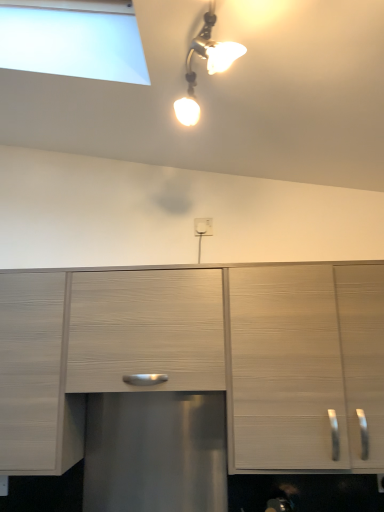
At what (x,y) coordinates should I click in order to perform the action: click on light wood cabinet at right, the second cabinetry when ordered from left to right. Please return your answer as a coordinate pair (x, y). The image size is (384, 512). Looking at the image, I should click on (306, 365).

I want to click on white plastic electric outlet at center, so click(x=203, y=226).

The height and width of the screenshot is (512, 384). Describe the element at coordinates (146, 330) in the screenshot. I see `light wood drawer at center` at that location.

Where is `light wood cabinet at right, the first cabinetry when ordered from right to left`? light wood cabinet at right, the first cabinetry when ordered from right to left is located at coordinates (306, 365).

Between point (243, 456) and point (212, 357), which one is positioned in front?

The point (243, 456) is more forward.

Is light wood cabinet at right, the first cabinetry when ordered from right to left, shorter than light wood drawer at center?

In fact, light wood cabinet at right, the first cabinetry when ordered from right to left, may be taller than light wood drawer at center.

Where is `the 1st cabinetry below the light wood drawer at center (from the image's perspective)`? The width and height of the screenshot is (384, 512). the 1st cabinetry below the light wood drawer at center (from the image's perspective) is located at coordinates (306, 365).

Considering the relative sizes of light wood cabinet at right, the second cabinetry when ordered from left to right, and matte wood cabinet at left, which is counted as the second cabinetry, starting from the right, in the image provided, is light wood cabinet at right, the second cabinetry when ordered from left to right, wider than matte wood cabinet at left, which is counted as the second cabinetry, starting from the right,?

No.

Is matte wood cabinet at left, which is counted as the second cabinetry, starting from the right, surrounded by light wood cabinet at right, the second cabinetry when ordered from left to right?

No, matte wood cabinet at left, which is counted as the second cabinetry, starting from the right, is not surrounded by light wood cabinet at right, the second cabinetry when ordered from left to right.

This screenshot has width=384, height=512. In order to click on cabinetry in front of the matte wood cabinet at left, the first cabinetry when ordered from left to right in this screenshot , I will do click(306, 365).

Consider the image. Is light wood cabinet at right, the first cabinetry when ordered from right to left, taller or shorter than matte wood cabinet at left, the first cabinetry when ordered from left to right?

Considering their sizes, light wood cabinet at right, the first cabinetry when ordered from right to left, has more height than matte wood cabinet at left, the first cabinetry when ordered from left to right.

Is light wood drawer at center facing away from matte wood cabinet at left, the first cabinetry when ordered from left to right?

light wood drawer at center is not turned away from matte wood cabinet at left, the first cabinetry when ordered from left to right.

Between light wood drawer at center and matte wood cabinet at left, the first cabinetry when ordered from left to right, which one has larger width?

With larger width is matte wood cabinet at left, the first cabinetry when ordered from left to right.

Is there a large distance between light wood drawer at center and matte wood cabinet at left, which is counted as the second cabinetry, starting from the right?

No, there isn't a large distance between light wood drawer at center and matte wood cabinet at left, which is counted as the second cabinetry, starting from the right.

Can you confirm if light wood drawer at center is positioned to the left of matte wood cabinet at left, which is counted as the second cabinetry, starting from the right?

No, light wood drawer at center is not to the left of matte wood cabinet at left, which is counted as the second cabinetry, starting from the right.

You are a GUI agent. You are given a task and a screenshot of the screen. Output one action in this format:
    pyautogui.click(x=<x>, y=<y>)
    Task: Click on the cabinetry that is in front of the matte wood cabinet at left, which is counted as the second cabinetry, starting from the right
    The height and width of the screenshot is (512, 384).
    Given the screenshot: What is the action you would take?
    pyautogui.click(x=306, y=365)

From the image's perspective, who appears lower, matte wood cabinet at left, the first cabinetry when ordered from left to right, or light wood cabinet at right, the first cabinetry when ordered from right to left?

matte wood cabinet at left, the first cabinetry when ordered from left to right.

Could you measure the distance between matte wood cabinet at left, the first cabinetry when ordered from left to right, and light wood cabinet at right, the second cabinetry when ordered from left to right?

matte wood cabinet at left, the first cabinetry when ordered from left to right, is 84.53 centimeters away from light wood cabinet at right, the second cabinetry when ordered from left to right.

Considering the points (55, 423) and (207, 230), which point is behind, point (55, 423) or point (207, 230)?

The point (207, 230) is behind.

From the image's perspective, is matte wood cabinet at left, the first cabinetry when ordered from left to right, positioned above or below white plastic electric outlet at center?

Clearly, from the image's perspective, matte wood cabinet at left, the first cabinetry when ordered from left to right, is below white plastic electric outlet at center.

Is matte wood cabinet at left, the first cabinetry when ordered from left to right, facing away from white plastic electric outlet at center?

No, matte wood cabinet at left, the first cabinetry when ordered from left to right,'s orientation is not away from white plastic electric outlet at center.

Consider the image. Who is smaller, matte wood cabinet at left, which is counted as the second cabinetry, starting from the right, or white plastic electric outlet at center?

With smaller size is white plastic electric outlet at center.

Is matte wood cabinet at left, which is counted as the second cabinetry, starting from the right, aimed at light wood drawer at center?

No, matte wood cabinet at left, which is counted as the second cabinetry, starting from the right, is not turned towards light wood drawer at center.

Would you consider matte wood cabinet at left, which is counted as the second cabinetry, starting from the right, to be distant from light wood drawer at center?

They are positioned close to each other.

From the image's perspective, is light wood cabinet at right, the first cabinetry when ordered from right to left, above or below white plastic electric outlet at center?

light wood cabinet at right, the first cabinetry when ordered from right to left, is situated lower than white plastic electric outlet at center in the image.

Considering the points (367, 359) and (209, 230), which point is in front, point (367, 359) or point (209, 230)?

The point (367, 359) is in front.

Is light wood cabinet at right, the second cabinetry when ordered from left to right, smaller than white plastic electric outlet at center?

No.

Consider the image. Which object is further away from the camera taking this photo, light wood cabinet at right, the second cabinetry when ordered from left to right, or white plastic electric outlet at center?

white plastic electric outlet at center is further away from the camera.

Identify the location of drawer lying on the left of light wood cabinet at right, the first cabinetry when ordered from right to left. (146, 330).

This screenshot has width=384, height=512. I want to click on cabinetry that is behind the light wood cabinet at right, the second cabinetry when ordered from left to right, so click(x=37, y=376).

Which object lies further to the anchor point white plastic electric outlet at center, light wood cabinet at right, the first cabinetry when ordered from right to left, or matte wood cabinet at left, the first cabinetry when ordered from left to right?

matte wood cabinet at left, the first cabinetry when ordered from left to right, is further to white plastic electric outlet at center.

Based on their spatial positions, is white plastic electric outlet at center or matte wood cabinet at left, which is counted as the second cabinetry, starting from the right, closer to light wood drawer at center?

matte wood cabinet at left, which is counted as the second cabinetry, starting from the right, is closer to light wood drawer at center.

From the image, which object appears to be nearer to light wood cabinet at right, the second cabinetry when ordered from left to right, matte wood cabinet at left, the first cabinetry when ordered from left to right, or white plastic electric outlet at center?

The object closer to light wood cabinet at right, the second cabinetry when ordered from left to right, is white plastic electric outlet at center.

Based on their spatial positions, is light wood drawer at center or light wood cabinet at right, the first cabinetry when ordered from right to left, further from white plastic electric outlet at center?

light wood cabinet at right, the first cabinetry when ordered from right to left.

In the scene shown: Estimate the real-world distances between objects in this image. Which object is further from white plastic electric outlet at center, light wood cabinet at right, the first cabinetry when ordered from right to left, or light wood drawer at center?

light wood cabinet at right, the first cabinetry when ordered from right to left, is further to white plastic electric outlet at center.

Which object lies further to the anchor point white plastic electric outlet at center, matte wood cabinet at left, which is counted as the second cabinetry, starting from the right, or light wood drawer at center?

The object further to white plastic electric outlet at center is matte wood cabinet at left, which is counted as the second cabinetry, starting from the right.

From the image, which object appears to be nearer to matte wood cabinet at left, which is counted as the second cabinetry, starting from the right, light wood drawer at center or light wood cabinet at right, the second cabinetry when ordered from left to right?

light wood drawer at center.

Estimate the real-world distances between objects in this image. Which object is further from matte wood cabinet at left, which is counted as the second cabinetry, starting from the right, light wood cabinet at right, the second cabinetry when ordered from left to right, or white plastic electric outlet at center?

The object further to matte wood cabinet at left, which is counted as the second cabinetry, starting from the right, is white plastic electric outlet at center.

I want to click on electric outlet between matte wood cabinet at left, which is counted as the second cabinetry, starting from the right, and light wood cabinet at right, the second cabinetry when ordered from left to right, in the horizontal direction, so click(x=203, y=226).

Find the location of `electric outlet between light wood drawer at center and light wood cabinet at right, the second cabinetry when ordered from left to right`. electric outlet between light wood drawer at center and light wood cabinet at right, the second cabinetry when ordered from left to right is located at coordinates (203, 226).

Locate an element on the screen. drawer between matte wood cabinet at left, which is counted as the second cabinetry, starting from the right, and light wood cabinet at right, the second cabinetry when ordered from left to right is located at coordinates (146, 330).

Where is `drawer between matte wood cabinet at left, the first cabinetry when ordered from left to right, and white plastic electric outlet at center, in the horizontal direction`? drawer between matte wood cabinet at left, the first cabinetry when ordered from left to right, and white plastic electric outlet at center, in the horizontal direction is located at coordinates pos(146,330).